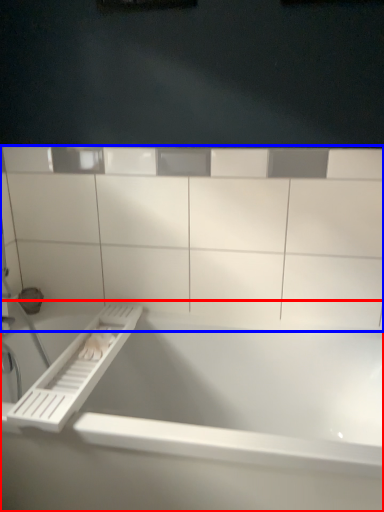
Question: Which point is further to the camera, bathtub (highlighted by a red box) or ledge (highlighted by a blue box)?

Choices:
 (A) bathtub
 (B) ledge

Answer: (B)